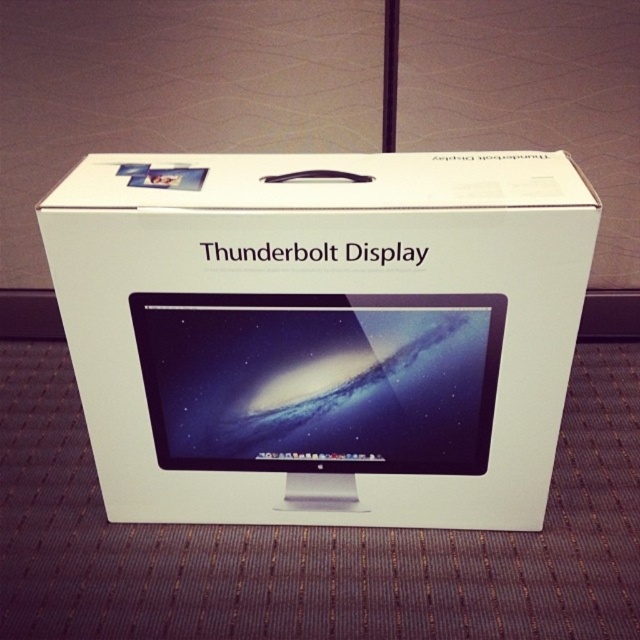
Who is higher up, white matte cardboard box at center or satin black monitor at center?

white matte cardboard box at center

Between point (273, 362) and point (480, 349), which one is positioned behind?

Positioned behind is point (273, 362).

Does point (262, 406) come farther from viewer compared to point (164, 458)?

No, it is not.

Identify the location of white matte cardboard box at center. This screenshot has width=640, height=640. (323, 332).